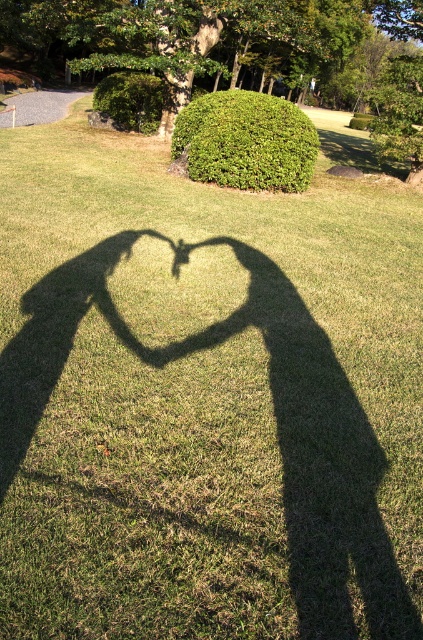
Is green leafy bush at upper center thinner than green leafy hedge at upper center?

Indeed, green leafy bush at upper center has a lesser width compared to green leafy hedge at upper center.

Between green leafy bush at upper center and green leafy hedge at upper center, which one is positioned lower?

green leafy bush at upper center

Which is behind, point (217, 92) or point (121, 83)?

The point (217, 92) is behind.

Where is `green leafy bush at upper center`? The image size is (423, 640). green leafy bush at upper center is located at coordinates (247, 141).